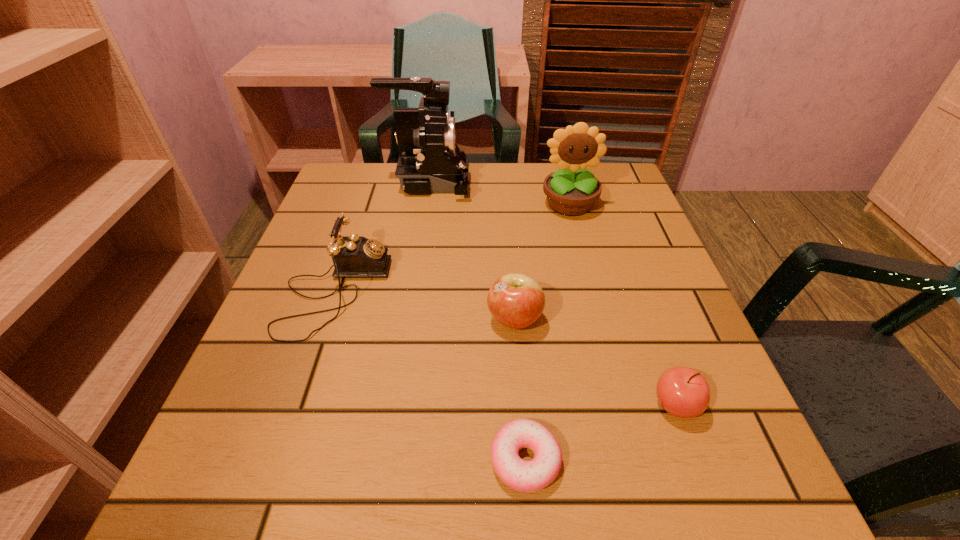
Image resolution: width=960 pixels, height=540 pixels. What are the coordinates of `camcorder` in the screenshot? It's located at point(430,161).

At what (x,y) coordinates should I click in order to perform the action: click on sunflower. Please return your answer as a coordinate pair (x, y). This screenshot has width=960, height=540. Looking at the image, I should click on (572, 190).

Locate an element on the screen. The width and height of the screenshot is (960, 540). the fourth shortest object is located at coordinates (353, 256).

The image size is (960, 540). Identify the location of the farther apple. (515, 300).

Where is `the nearer apple`? This screenshot has height=540, width=960. the nearer apple is located at coordinates (683, 392).

Where is `the fifth farthest object`? This screenshot has width=960, height=540. the fifth farthest object is located at coordinates (683, 392).

This screenshot has height=540, width=960. I want to click on the shortest object, so click(524, 476).

You are a GUI agent. You are given a task and a screenshot of the screen. Output one action in this format:
    pyautogui.click(x=<x>, y=<y>)
    Task: Click on the nearest object
    This screenshot has height=540, width=960.
    Given the screenshot: What is the action you would take?
    pyautogui.click(x=524, y=476)

Locate an element on the screen. Image resolution: width=960 pixels, height=540 pixels. blank space located on the lens mount of the camcorder is located at coordinates (625, 183).

Find the location of a particular element. The width and height of the screenshot is (960, 540). free space located 0.230m on the face of the sunflower is located at coordinates (591, 291).